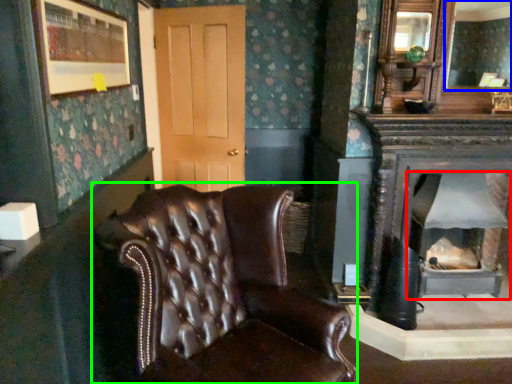
Question: Which object is the closest to the wood burning stove (highlighted by a red box)? Choose among these: mirror (highlighted by a blue box) or chair (highlighted by a green box).

Choices:
 (A) mirror
 (B) chair

Answer: (B)